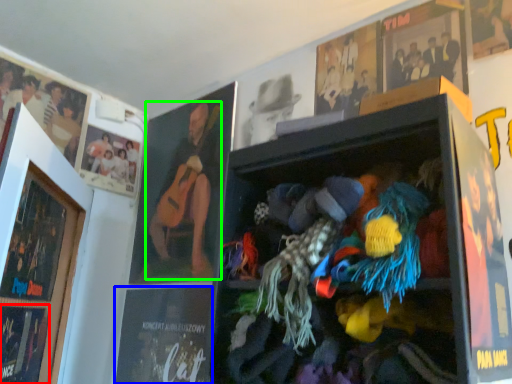
Question: Based on their relative distances, which object is nearer to magazine (highlighted by a red box)? Choose from magazine (highlighted by a blue box) and person (highlighted by a green box).

Choices:
 (A) magazine
 (B) person

Answer: (A)